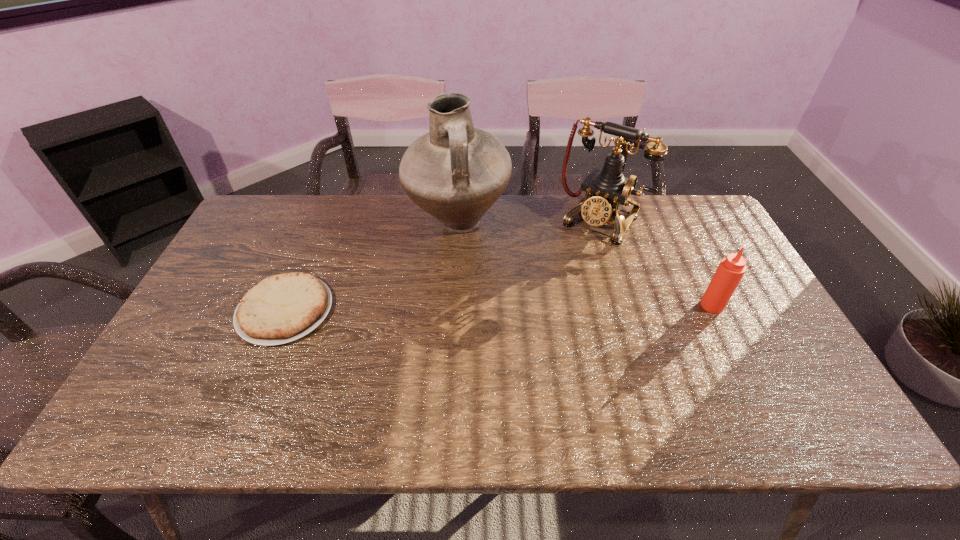
You are a GUI agent. You are given a task and a screenshot of the screen. Output one action in this format:
    pyautogui.click(x=<x>, y=<y>)
    Task: Click on the free space on the desktop that is between the leftmost object and the second shortest object and is positioned on the handle side of the second object from left to right
    Image resolution: width=960 pixels, height=540 pixels.
    Given the screenshot: What is the action you would take?
    pyautogui.click(x=517, y=308)

Identify the location of vacant space on the desktop that is between the shortest object and the third tallest object and is positioned on the front of the third object from left to right, featuring the rotary dial. (540, 307).